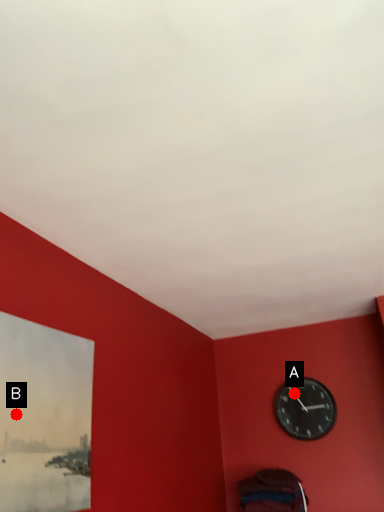
Question: Two points are circled on the image, labeled by A and B beside each circle. Which of the following is the closest to the observer?

Choices:
 (A) A is closer
 (B) B is closer

Answer: (B)